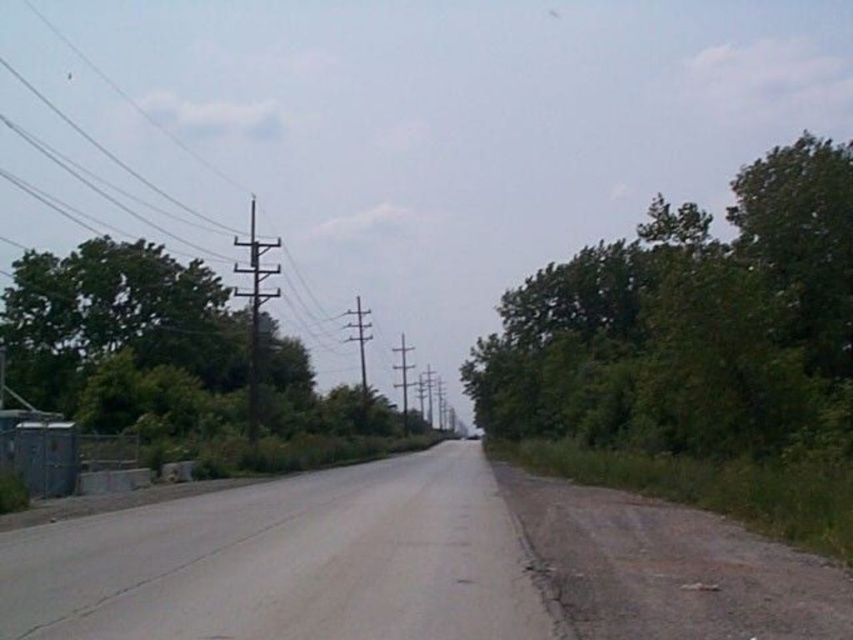
Question: Based on their relative distances, which object is nearer to the green leafy tree at left?

Choices:
 (A) metallic gray telegraph pole at left
 (B) smooth wood telegraph pole at center
 (C) green leafy tree at upper right

Answer: (A)

Question: Does metallic gray telegraph pole at center come behind smooth wood telegraph pole at center?

Choices:
 (A) no
 (B) yes

Answer: (A)

Question: Which object is the closest to the green leafy tree at upper right?

Choices:
 (A) smooth wood telegraph pole at center
 (B) metallic gray telegraph pole at center
 (C) brown wooden utility pole at upper center

Answer: (B)

Question: Does brown wooden utility pole at upper center come behind metallic gray telegraph pole at center?

Choices:
 (A) no
 (B) yes

Answer: (A)

Question: Which of the following is the closest to the observer?

Choices:
 (A) brown wooden utility pole at upper center
 (B) green leafy tree at upper right
 (C) metallic gray telegraph pole at left

Answer: (B)

Question: Is green leafy tree at left positioned at the back of smooth wood telegraph pole at center?

Choices:
 (A) yes
 (B) no

Answer: (B)